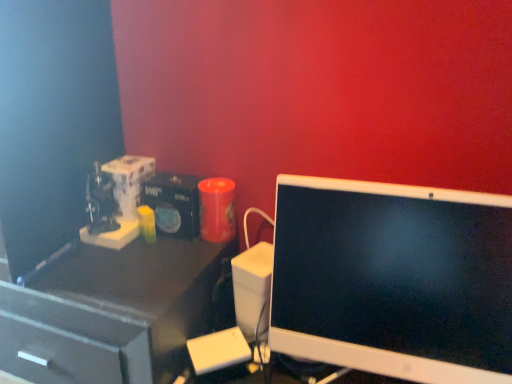
Question: From a real-world perspective, relative to white glossy computer monitor at right, is matte black desk at left vertically above or below?

Choices:
 (A) below
 (B) above

Answer: (A)

Question: Is matte black desk at left spatially inside white glossy computer monitor at right, or outside of it?

Choices:
 (A) outside
 (B) inside

Answer: (A)

Question: Is matte black desk at left in front of or behind white glossy computer monitor at right in the image?

Choices:
 (A) front
 (B) behind

Answer: (B)

Question: From a real-world perspective, is white glossy computer monitor at right above or below matte black desk at left?

Choices:
 (A) below
 (B) above

Answer: (B)

Question: From the image's perspective, is white glossy computer monitor at right above or below matte black desk at left?

Choices:
 (A) above
 (B) below

Answer: (A)

Question: Does point (283, 294) appear closer or farther from the camera than point (119, 309)?

Choices:
 (A) closer
 (B) farther

Answer: (B)

Question: Relative to matte black desk at left, is white glossy computer monitor at right in front or behind?

Choices:
 (A) front
 (B) behind

Answer: (A)